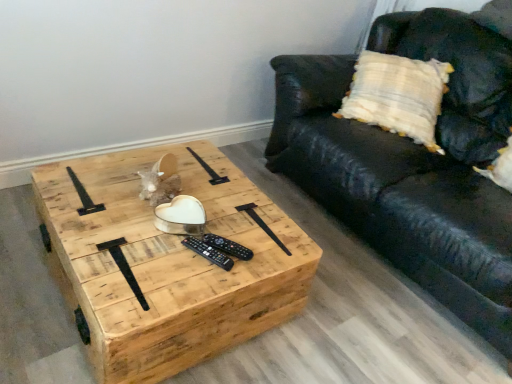
Find the location of a particular element. black plastic remote at center, the 2th remote when ordered from front to back is located at coordinates (228, 246).

The height and width of the screenshot is (384, 512). Find the location of `natural wood coffee table at center`. natural wood coffee table at center is located at coordinates (167, 264).

Looking at this image, is black leather couch at center oriented away from black plastic remote at center, the 2th remote in the back-to-front sequence?

No.

How far apart are black leather couch at center and black plastic remote at center, the 1th remote viewed from the front?

They are 1.07 meters apart.

Between black leather couch at center and black plastic remote at center, the 1th remote viewed from the front, which one appears on the right side from the viewer's perspective?

black leather couch at center is more to the right.

Does black leather couch at center have a lesser height compared to black plastic remote at center, the 1th remote viewed from the front?

In fact, black leather couch at center may be taller than black plastic remote at center, the 1th remote viewed from the front.

What's the angular difference between natural wood coffee table at center and black plastic remote at center, the 1th remote viewed from the front,'s facing directions?

There is a 25-degree angle between the facing directions of natural wood coffee table at center and black plastic remote at center, the 1th remote viewed from the front.

Considering the sizes of objects natural wood coffee table at center and black plastic remote at center, the 2th remote in the back-to-front sequence, in the image provided, who is thinner, natural wood coffee table at center or black plastic remote at center, the 2th remote in the back-to-front sequence,?

With smaller width is black plastic remote at center, the 2th remote in the back-to-front sequence.

From the natural wood coffee table at center, count 1st remote to the right and point to it. Please provide its 2D coordinates.

[(208, 253)]

Is natural wood coffee table at center taller or shorter than black plastic remote at center, the 1th remote viewed from the front?

natural wood coffee table at center is taller than black plastic remote at center, the 1th remote viewed from the front.

Is black plastic remote at center, the 2th remote in the back-to-front sequence, to the left of natural wood coffee table at center from the viewer's perspective?

In fact, black plastic remote at center, the 2th remote in the back-to-front sequence, is to the right of natural wood coffee table at center.

From a real-world perspective, is black plastic remote at center, the 1th remote viewed from the front, above or below natural wood coffee table at center?

In terms of real-world spatial position, black plastic remote at center, the 1th remote viewed from the front, is above natural wood coffee table at center.

This screenshot has height=384, width=512. What are the coordinates of `the 1st remote directly above the natural wood coffee table at center (from a real-world perspective)` in the screenshot? It's located at (208, 253).

Is natural wood coffee table at center completely or partially inside black plastic remote at center, the 2th remote in the back-to-front sequence?

No.

Who is bigger, natural wood coffee table at center or black plastic remote at center, which is the 1th remote from back to front?

natural wood coffee table at center.

In the scene shown: Does natural wood coffee table at center have a greater width compared to black plastic remote at center, which is the 1th remote from back to front?

Yes.

Can you tell me how much natural wood coffee table at center and black plastic remote at center, which is the 1th remote from back to front, differ in facing direction?

The angular difference between natural wood coffee table at center and black plastic remote at center, which is the 1th remote from back to front, is 26 degrees.

Considering the relative positions of natural wood coffee table at center and black plastic remote at center, the 2th remote when ordered from front to back, in the image provided, is natural wood coffee table at center behind black plastic remote at center, the 2th remote when ordered from front to back,?

No, natural wood coffee table at center is in front of black plastic remote at center, the 2th remote when ordered from front to back.

Which is behind, point (350, 166) or point (237, 253)?

The point (350, 166) is behind.

Is black leather couch at center positioned beyond the bounds of black plastic remote at center, which is the 1th remote from back to front?

Yes, black leather couch at center is not within black plastic remote at center, which is the 1th remote from back to front.

From a real-world perspective, is black leather couch at center physically located above or below black plastic remote at center, the 2th remote when ordered from front to back?

Clearly, from a real-world perspective, black leather couch at center is above black plastic remote at center, the 2th remote when ordered from front to back.

Can you tell me how much black leather couch at center and black plastic remote at center, which is the 1th remote from back to front, differ in facing direction?

black leather couch at center and black plastic remote at center, which is the 1th remote from back to front, are facing 113 degrees away from each other.

Considering their positions, is black leather couch at center located in front of or behind natural wood coffee table at center?

Visually, black leather couch at center is located in front of natural wood coffee table at center.

In the scene shown: Which object is positioned more to the right, black leather couch at center or natural wood coffee table at center?

black leather couch at center is more to the right.

Does point (314, 118) lie in front of point (132, 268)?

No.

How distant is black leather couch at center from natural wood coffee table at center?

They are 30.97 inches apart.

Is black plastic remote at center, the 2th remote when ordered from front to back, in front of natural wood coffee table at center?

No, black plastic remote at center, the 2th remote when ordered from front to back, is behind natural wood coffee table at center.

Could you tell me if black plastic remote at center, which is the 1th remote from back to front, is turned towards natural wood coffee table at center?

No, black plastic remote at center, which is the 1th remote from back to front, is not turned towards natural wood coffee table at center.

Starting from the natural wood coffee table at center, which remote is the 2nd one behind? Please provide its 2D coordinates.

[(228, 246)]

From the image's perspective, which object appears higher, black plastic remote at center, which is the 1th remote from back to front, or natural wood coffee table at center?

black plastic remote at center, which is the 1th remote from back to front, appears higher in the image.

This screenshot has width=512, height=384. Find the location of `the 2nd remote counting from the left of the black leather couch at center`. the 2nd remote counting from the left of the black leather couch at center is located at coordinates [208, 253].

Locate an element on the screen. The image size is (512, 384). the 1st remote behind the natural wood coffee table at center is located at coordinates (208, 253).

Estimate the real-world distances between objects in this image. Which object is further from black leather couch at center, natural wood coffee table at center or black plastic remote at center, the 2th remote when ordered from front to back?

Among the two, black plastic remote at center, the 2th remote when ordered from front to back, is located further to black leather couch at center.

Based on their spatial positions, is natural wood coffee table at center or black plastic remote at center, the 2th remote in the back-to-front sequence, further from black leather couch at center?

black plastic remote at center, the 2th remote in the back-to-front sequence, is positioned further to the anchor black leather couch at center.

In the scene shown: When comparing their distances from natural wood coffee table at center, does black plastic remote at center, which is the 1th remote from back to front, or black leather couch at center seem closer?

Based on the image, black plastic remote at center, which is the 1th remote from back to front, appears to be nearer to natural wood coffee table at center.

When comparing their distances from natural wood coffee table at center, does black leather couch at center or black plastic remote at center, the 2th remote in the back-to-front sequence, seem closer?

Based on the image, black plastic remote at center, the 2th remote in the back-to-front sequence, appears to be nearer to natural wood coffee table at center.

When comparing their distances from black plastic remote at center, which is the 1th remote from back to front, does natural wood coffee table at center or black leather couch at center seem closer?

natural wood coffee table at center is positioned closer to the anchor black plastic remote at center, which is the 1th remote from back to front.

When comparing their distances from natural wood coffee table at center, does black plastic remote at center, the 1th remote viewed from the front, or black leather couch at center seem closer?

The object closer to natural wood coffee table at center is black plastic remote at center, the 1th remote viewed from the front.

When comparing their distances from black leather couch at center, does black plastic remote at center, the 2th remote when ordered from front to back, or black plastic remote at center, the 1th remote viewed from the front, seem further?

Based on the image, black plastic remote at center, the 1th remote viewed from the front, appears to be further to black leather couch at center.

In the scene shown: From the image, which object appears to be nearer to natural wood coffee table at center, black plastic remote at center, the 2th remote when ordered from front to back, or black plastic remote at center, the 1th remote viewed from the front?

black plastic remote at center, the 1th remote viewed from the front, is closer to natural wood coffee table at center.

At what (x,y) coordinates should I click in order to perform the action: click on remote between natural wood coffee table at center and black plastic remote at center, which is the 1th remote from back to front, in the front-back direction. Please return your answer as a coordinate pair (x, y). The width and height of the screenshot is (512, 384). Looking at the image, I should click on click(208, 253).

Where is `remote between black plastic remote at center, the 1th remote viewed from the front, and black leather couch at center`? This screenshot has width=512, height=384. remote between black plastic remote at center, the 1th remote viewed from the front, and black leather couch at center is located at coordinates (228, 246).